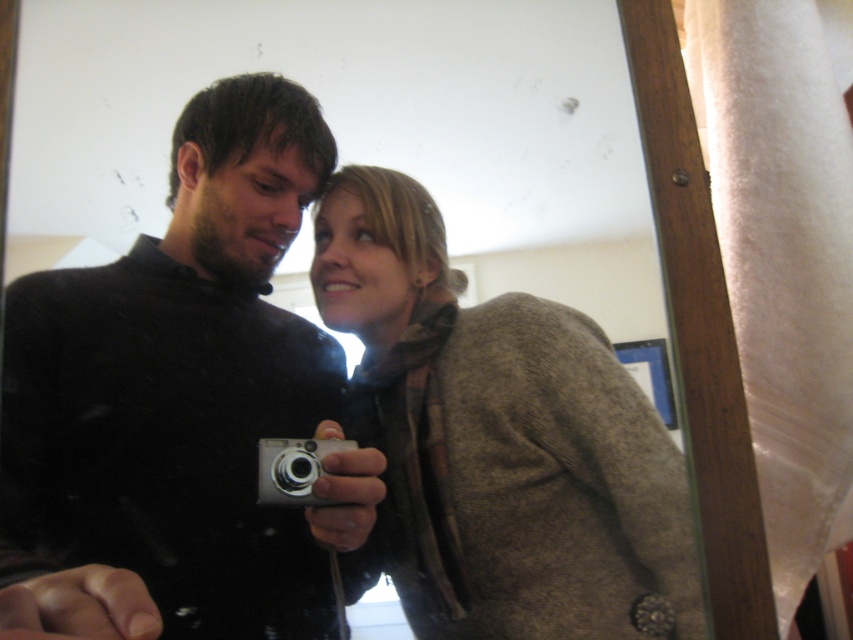
Can you confirm if matte black camera at center is wider than silver metallic camera at center?

Correct, the width of matte black camera at center exceeds that of silver metallic camera at center.

Can you confirm if matte black camera at center is bigger than silver metallic camera at center?

Yes, matte black camera at center is bigger than silver metallic camera at center.

Which is in front, point (202, 394) or point (279, 467)?

Point (279, 467) is more forward.

Locate an element on the screen. matte black camera at center is located at coordinates (181, 404).

Which is above, brown woolen coat at center or silver metallic camera at center?

brown woolen coat at center is higher up.

Which is more to the right, brown woolen coat at center or silver metallic camera at center?

Positioned to the right is brown woolen coat at center.

This screenshot has height=640, width=853. What are the coordinates of `brown woolen coat at center` in the screenshot? It's located at (500, 440).

From the picture: Is matte black camera at center thinner than brown woolen coat at center?

No.

The image size is (853, 640). What do you see at coordinates (181, 404) in the screenshot?
I see `matte black camera at center` at bounding box center [181, 404].

Who is more forward, [288,632] or [602,426]?

Positioned in front is point [288,632].

Locate an element on the screen. matte black camera at center is located at coordinates (181, 404).